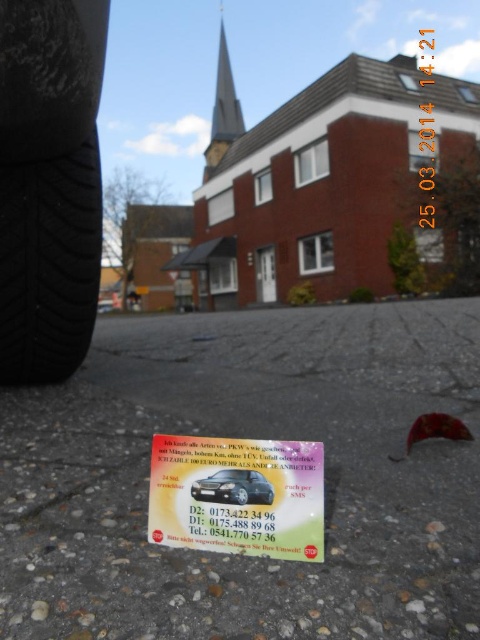
From the picture: You are a delivery person who needs to place a small package between the black rubber tire at left and the black glossy car at lower center. Can you fit the package in the space between them?

The black rubber tire at left is to the left of the black glossy car at lower center, so there is space between them to place the package.

You are a delivery person who needs to place a box between the black rubber tire at left and the black glossy car at lower center. The box is 1.2 meters wide. Can the box fit in the space between them?

The black rubber tire at left is wider than the black glossy car at lower center. However, the description only provides information about their widths, not the distance between them. Without knowing the actual distance between the two objects, it is impossible to determine if the box will fit.